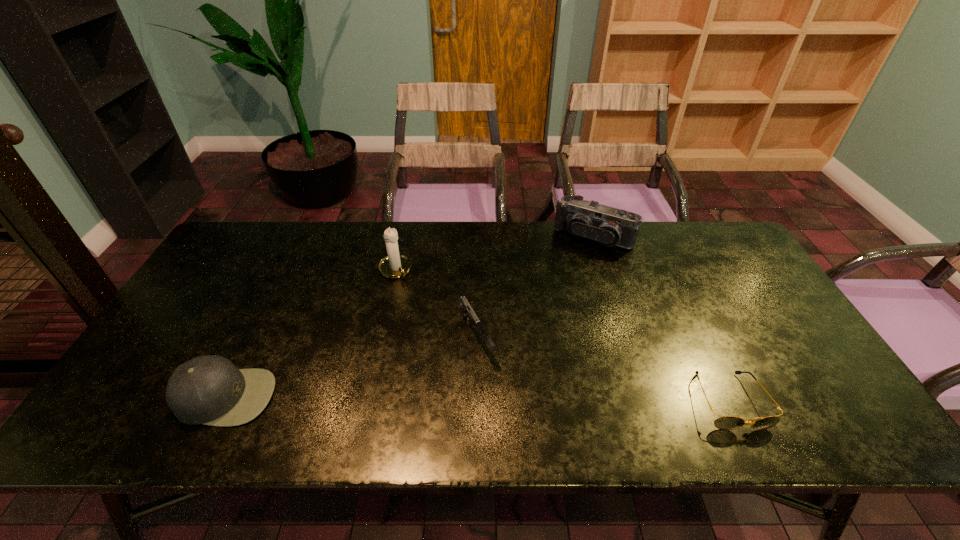
You are a GUI agent. You are given a task and a screenshot of the screen. Output one action in this format:
    pyautogui.click(x=<x>, y=<y>)
    Task: Click on the free spot between the farthest object and the candle holder
    
    Given the screenshot: What is the action you would take?
    coord(493,253)

The image size is (960, 540). In order to click on empty location between the camcorder and the fourth nearest object in this screenshot , I will do `click(493, 253)`.

Where is `free point between the third tallest object and the fourth tallest object`? The height and width of the screenshot is (540, 960). free point between the third tallest object and the fourth tallest object is located at coordinates (351, 367).

This screenshot has height=540, width=960. I want to click on blank region between the sunglasses and the cap, so click(477, 399).

Image resolution: width=960 pixels, height=540 pixels. In order to click on vacant space in between the sunglasses and the third nearest object in this screenshot , I will do `click(603, 369)`.

Where is `free point between the candle holder and the camcorder`? This screenshot has width=960, height=540. free point between the candle holder and the camcorder is located at coordinates (493, 253).

Where is `free spot between the fourth tallest object and the second farthest object`? Image resolution: width=960 pixels, height=540 pixels. free spot between the fourth tallest object and the second farthest object is located at coordinates [x=436, y=303].

You are a GUI agent. You are given a task and a screenshot of the screen. Output one action in this format:
    pyautogui.click(x=<x>, y=<y>)
    Task: Click on the second closest object to the fourth shortest object
    
    Given the screenshot: What is the action you would take?
    pyautogui.click(x=395, y=265)

Identify which object is the fourth closest to the shortest object. Please provide its 2D coordinates. Your answer should be formatted as a tuple, i.e. [(x, y)], where the tuple contains the x and y coordinates of a point satisfying the conditions above.

[(208, 389)]

Where is `free point that satisfies the following two spatial constraints: 1. on the back side of the camcorder; 2. on the left side of the third object from right to left`? Image resolution: width=960 pixels, height=540 pixels. free point that satisfies the following two spatial constraints: 1. on the back side of the camcorder; 2. on the left side of the third object from right to left is located at coordinates (477, 237).